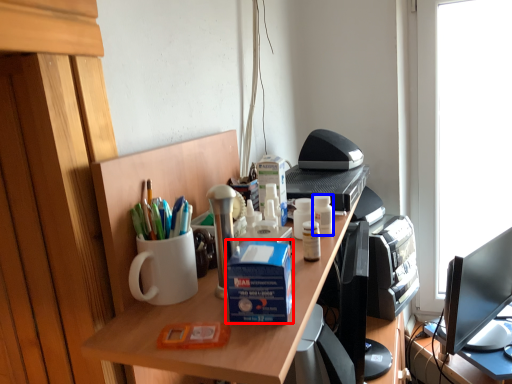
Question: Which of the following is the farthest to the observer, box (highlighted by a red box) or stationery (highlighted by a blue box)?

Choices:
 (A) box
 (B) stationery

Answer: (B)